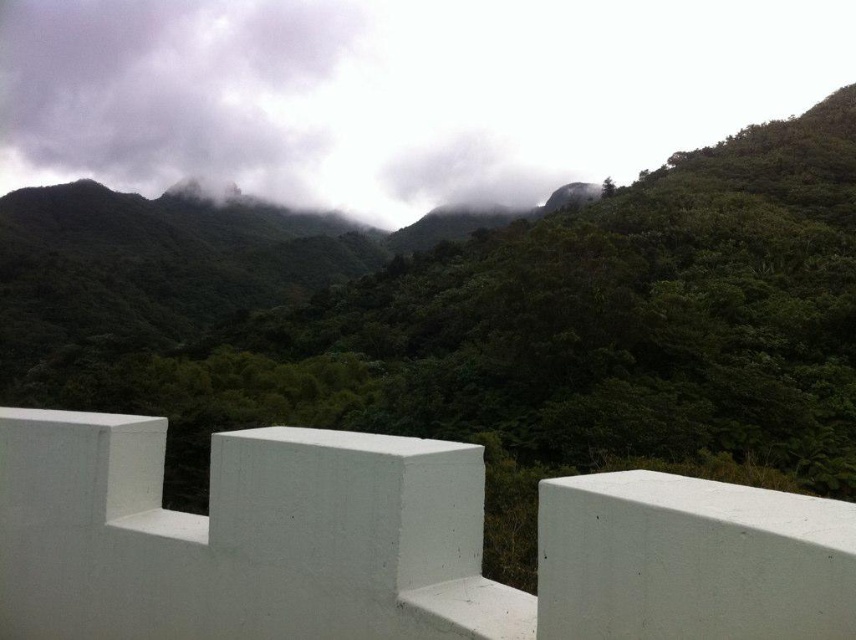
Can you confirm if green matte forest at upper center is shorter than dark gray cloud at upper left?

Yes.

Image resolution: width=856 pixels, height=640 pixels. I want to click on green matte forest at upper center, so click(544, 330).